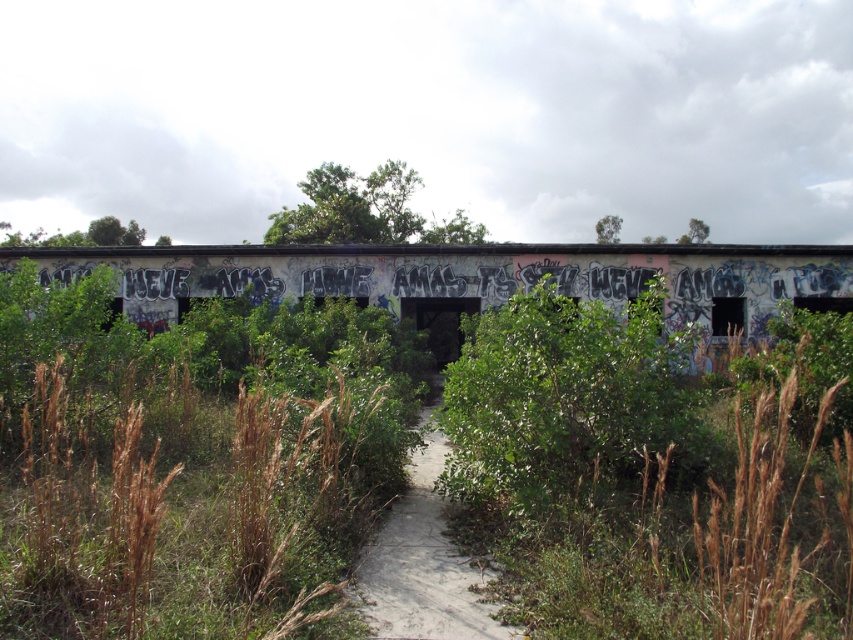
Question: Among these objects, which one is farthest from the camera?

Choices:
 (A) grungy concrete bridge at center
 (B) dirt path at center

Answer: (A)

Question: Is grungy concrete bridge at center wider than green leafy bush at center?

Choices:
 (A) no
 (B) yes

Answer: (B)

Question: Does grungy concrete bridge at center appear over green leafy bush at center?

Choices:
 (A) yes
 (B) no

Answer: (A)

Question: Considering the relative positions of grungy concrete bridge at center and green leafy bush at center in the image provided, where is grungy concrete bridge at center located with respect to green leafy bush at center?

Choices:
 (A) below
 (B) above

Answer: (B)

Question: Which of the following is the closest to the observer?

Choices:
 (A) grungy concrete bridge at center
 (B) green leafy bush at center
 (C) dirt path at center

Answer: (C)

Question: Which of the following is the farthest from the observer?

Choices:
 (A) (494, 636)
 (B) (589, 339)

Answer: (B)